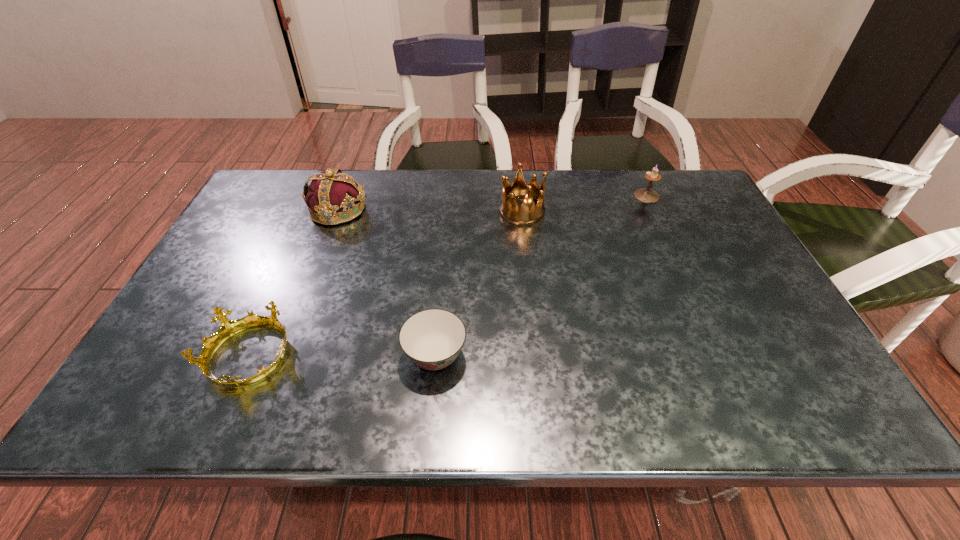
In order to click on crown situated at the near edge in this screenshot , I will do `click(228, 328)`.

The image size is (960, 540). I want to click on object that is at the left edge, so click(x=228, y=328).

Image resolution: width=960 pixels, height=540 pixels. Find the location of `object present at the right edge`. object present at the right edge is located at coordinates (644, 195).

The height and width of the screenshot is (540, 960). I want to click on object at the near left corner, so tap(228, 328).

The image size is (960, 540). I want to click on object located in the far right corner section of the desktop, so click(644, 195).

In the image, there is a desktop. Where is `vacant space at the far edge`? Image resolution: width=960 pixels, height=540 pixels. vacant space at the far edge is located at coordinates (521, 200).

I want to click on free space at the near edge of the desktop, so click(x=541, y=386).

In the image, there is a desktop. Identify the location of vacant space at the right edge. This screenshot has width=960, height=540. (740, 288).

This screenshot has width=960, height=540. What are the coordinates of `free space at the far left corner` in the screenshot? It's located at (276, 206).

Identify the location of vacant space at the near left corner of the desktop. The width and height of the screenshot is (960, 540). (155, 386).